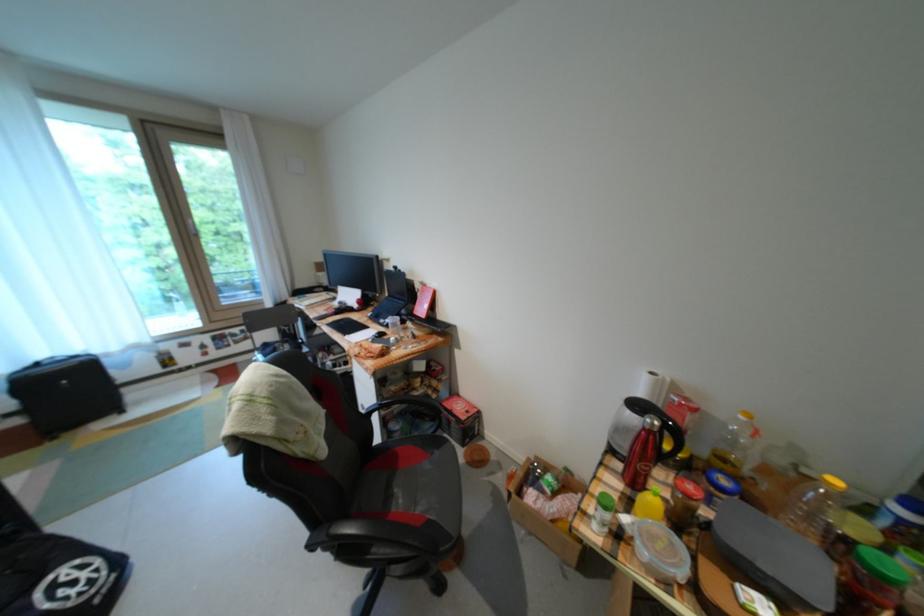
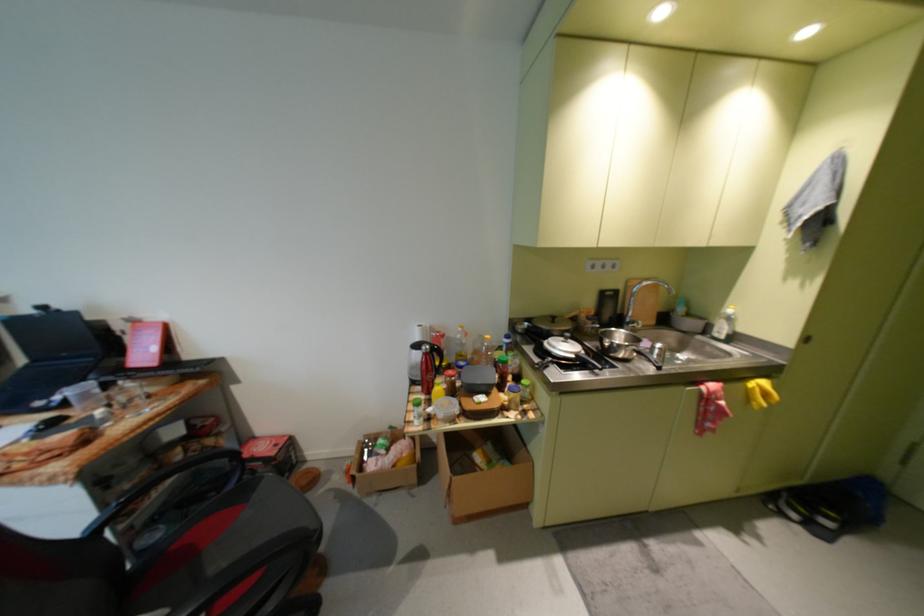
Find the pixel in the second image that matches (x=542, y=459) in the first image.

(372, 440)